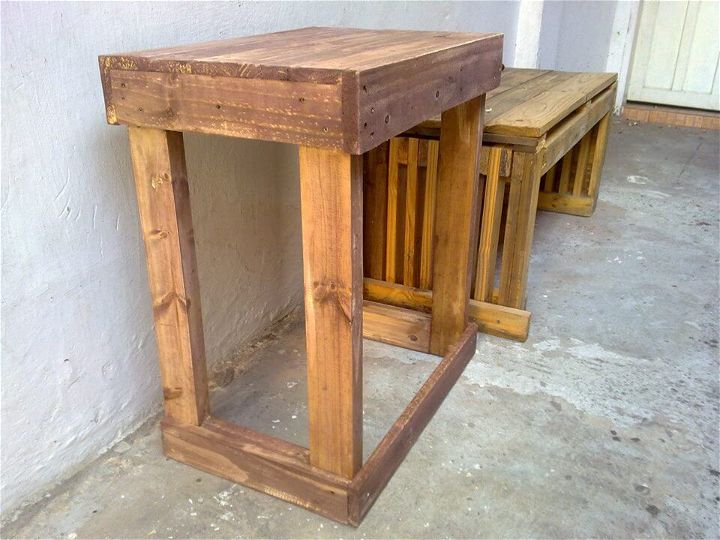
Find the location of a particular element. This screenshot has width=720, height=540. reddish bricks under door is located at coordinates (672, 118).